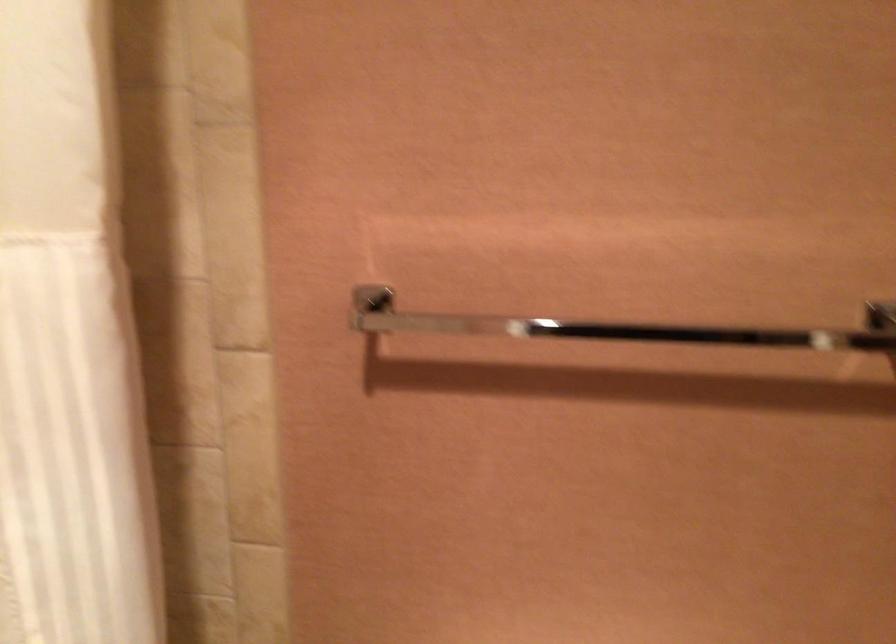
At what (x,y) coordinates should I click in order to perform the action: click on metal towel bar. Please return your answer as a coordinate pair (x, y). The width and height of the screenshot is (896, 644). Looking at the image, I should click on 616,327.